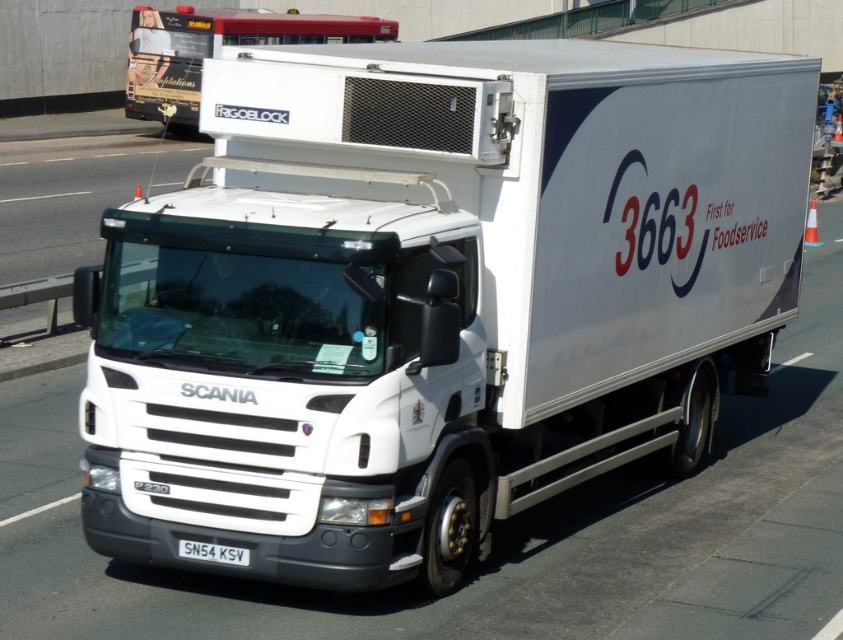
You are a delivery driver who needs to park the white matte truck at upper center under a low clearance bridge. The bridge has a height restriction sign indicating a maximum height of 4 meters. The license plate on the white plastic license plate at lower center is 15 cm tall. Can you estimate if the truck will fit under the bridge?

The white matte truck at upper center is taller than the white plastic license plate at lower center, which is 15 cm tall. However, without knowing the exact height of the truck itself, it is impossible to determine if it will fit under the 4 meter clearance bridge. Additional measurements of the truck are needed for an accurate assessment.

You are a pedestrian standing at point [228,554] and want to cross the road to reach a destination behind point [208,33]. Is the path between these two points clear of the Scania refrigerated delivery truck?

Point [208,33] is behind point [228,554], so the path between them would be blocked by the Scania refrigerated delivery truck as it is positioned between these two points.